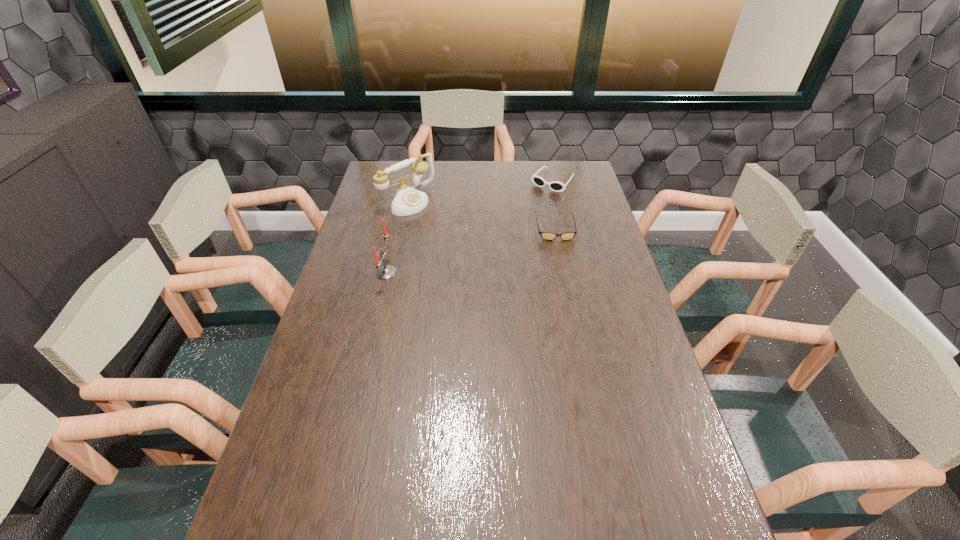
Identify the location of vacant position located on the dial of the telephone. The width and height of the screenshot is (960, 540). (459, 235).

Where is `blank space located on the dial of the telephone`? blank space located on the dial of the telephone is located at coordinates (461, 237).

At what (x,y) coordinates should I click in order to perform the action: click on free location located with the lenses of the taller sunglasses facing outward. Please return your answer as a coordinate pair (x, y). This screenshot has height=540, width=960. Looking at the image, I should click on (497, 246).

Locate an element on the screen. This screenshot has width=960, height=540. free space located with the lenses of the taller sunglasses facing outward is located at coordinates (514, 226).

This screenshot has width=960, height=540. What are the coordinates of `free space located with the lenses of the taller sunglasses facing outward` in the screenshot? It's located at (528, 211).

Identify the location of telephone present at the far edge. (407, 200).

This screenshot has width=960, height=540. I want to click on sunglasses that is positioned at the far edge, so 556,186.

The image size is (960, 540). In order to click on candle that is at the left edge in this screenshot , I will do `click(387, 271)`.

This screenshot has height=540, width=960. What are the coordinates of `telephone at the left edge` in the screenshot? It's located at (407, 200).

This screenshot has height=540, width=960. What are the coordinates of `object located in the far left corner section of the desktop` in the screenshot? It's located at (407, 200).